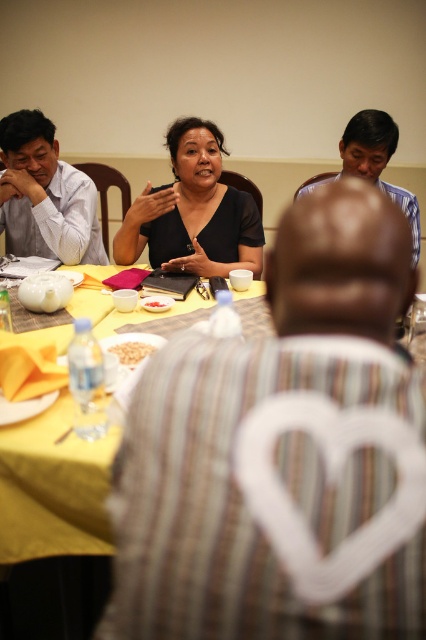
Question: Which object is closer to the camera taking this photo?

Choices:
 (A) black matte dress at center
 (B) matte white shirt at left
 (C) white crumbly food at center

Answer: (C)

Question: Estimate the real-world distances between objects in this image. Which object is closer to the matte white shirt at left?

Choices:
 (A) black matte dress at center
 (B) yellow fabric table at center

Answer: (A)

Question: Does black matte dress at center lie behind white matte bowl at center?

Choices:
 (A) no
 (B) yes

Answer: (B)

Question: Considering the relative positions of striped fabric shirt at center and yellow fabric table at center in the image provided, where is striped fabric shirt at center located with respect to yellow fabric table at center?

Choices:
 (A) below
 (B) above

Answer: (B)

Question: Is yellow fabric table at center to the left of black matte dress at center from the viewer's perspective?

Choices:
 (A) yes
 (B) no

Answer: (A)

Question: Which object is the closest to the white matte bowl at center?

Choices:
 (A) blue striped shirt at upper right
 (B) white crumbly food at center
 (C) matte white shirt at left
 (D) yellow fabric table at center

Answer: (B)